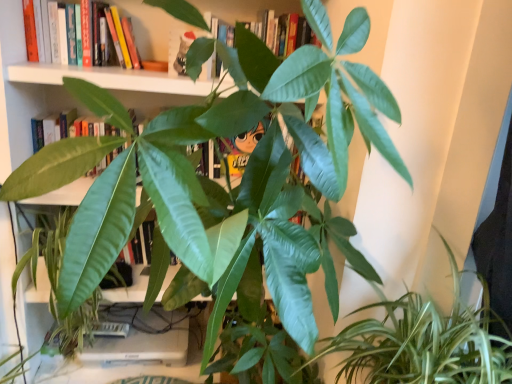
Question: From a real-world perspective, relative to hardcover book at upper left, is green glossy leafy plant at lower right vertically above or below?

Choices:
 (A) below
 (B) above

Answer: (A)

Question: Considering the positions of point (400, 311) and point (65, 18), is point (400, 311) closer or farther from the camera than point (65, 18)?

Choices:
 (A) closer
 (B) farther

Answer: (A)

Question: Is green glossy leafy plant at lower right inside or outside of hardcover book at upper left?

Choices:
 (A) outside
 (B) inside

Answer: (A)

Question: In the image, is hardcover book at upper left on the left side or the right side of green glossy leafy plant at lower right?

Choices:
 (A) left
 (B) right

Answer: (A)

Question: Is hardcover book at upper left taller or shorter than green glossy leafy plant at lower right?

Choices:
 (A) short
 (B) tall

Answer: (A)

Question: In terms of size, does hardcover book at upper left appear bigger or smaller than green glossy leafy plant at lower right?

Choices:
 (A) small
 (B) big

Answer: (A)

Question: Which is correct: hardcover book at upper left is inside green glossy leafy plant at lower right, or outside of it?

Choices:
 (A) inside
 (B) outside

Answer: (B)